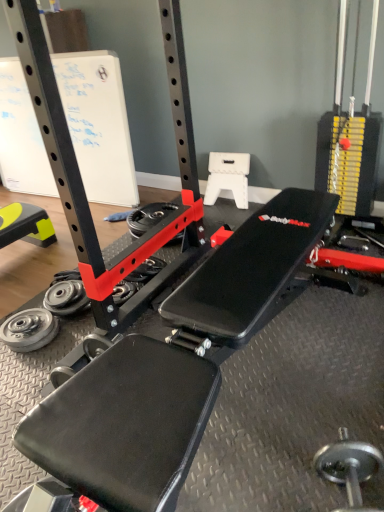
Question: Is yellow rubber mat at lower left bigger or smaller than white paperboard at upper left?

Choices:
 (A) small
 (B) big

Answer: (A)

Question: Considering their positions, is yellow rubber mat at lower left located in front of or behind white paperboard at upper left?

Choices:
 (A) front
 (B) behind

Answer: (A)

Question: Which object is the farthest from the silver metallic weight at lower left, acting as the second wheel starting from the bottom?

Choices:
 (A) silver metallic weight plate at lower left, acting as the third wheel starting from the top
 (B) red plastic wheel at center, the third wheel viewed from the front
 (C) yellow rubber mat at lower left
 (D) white paperboard at upper left
 (E) silver metallic dumbbell at lower right

Answer: (E)

Question: Based on their relative distances, which object is nearer to the red plastic wheel at center, positioned as the 1th wheel in right-to-left order?

Choices:
 (A) silver metallic weight plate at lower left, which appears as the 1th wheel when viewed from the front
 (B) white paperboard at upper left
 (C) silver metallic weight at lower left, which ranks as the 2th wheel in back-to-front order
 (D) yellow rubber mat at lower left
 (E) silver metallic dumbbell at lower right

Answer: (B)